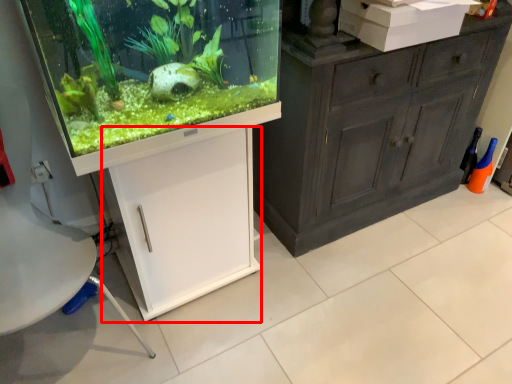
Question: From the image's perspective, what is the correct spatial relationship of cabinetry (annotated by the red box) in relation to box?

Choices:
 (A) below
 (B) above

Answer: (A)